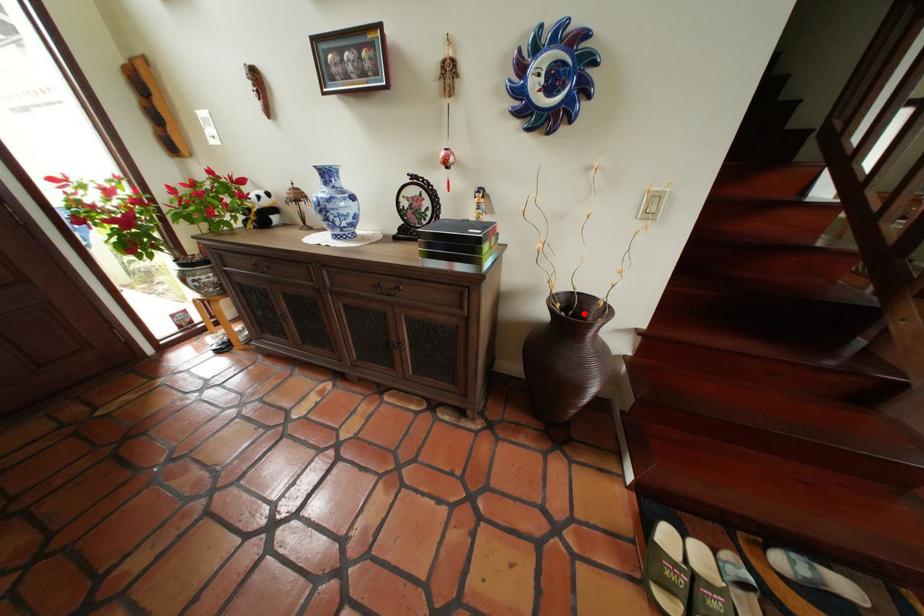
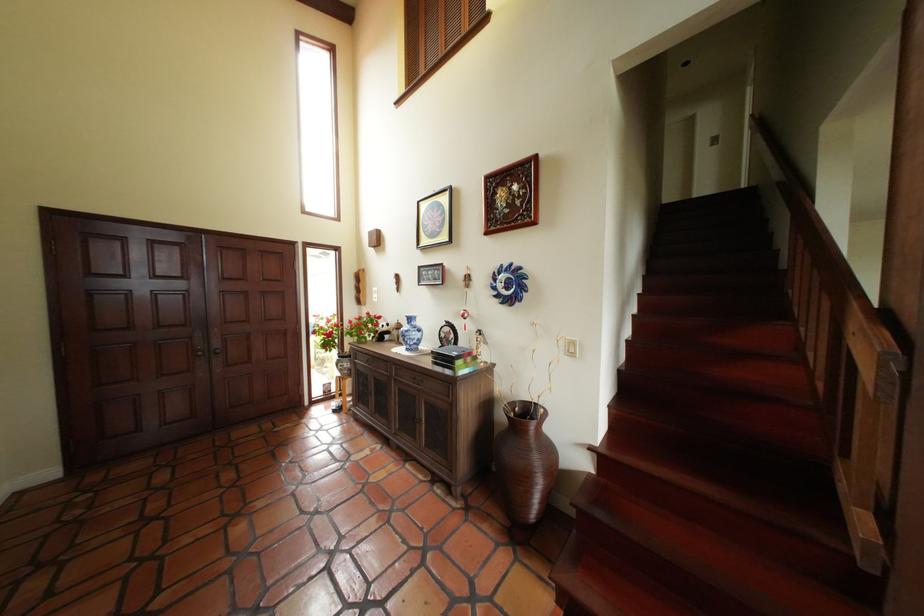
In the second image, find the point that corresponds to the highlighted location in the first image.

(541, 418)